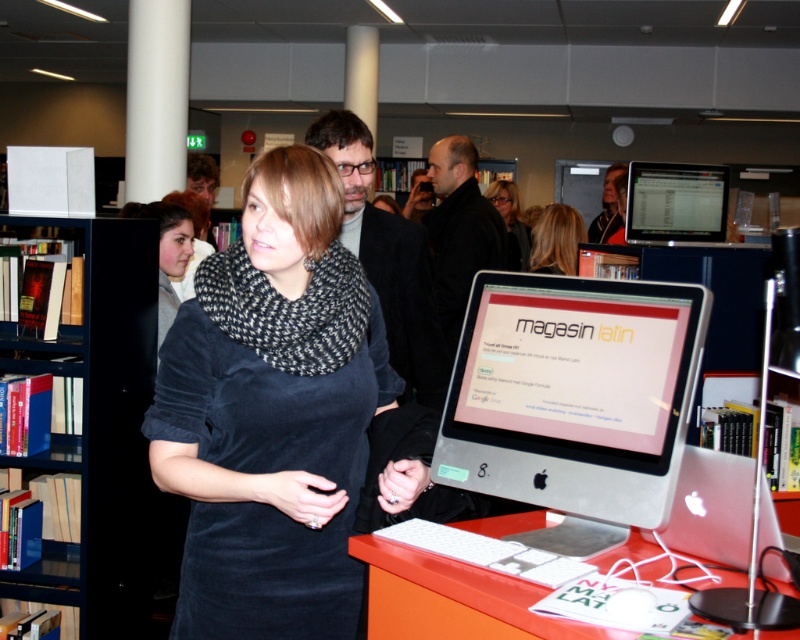
Question: Which point appears closest to the camera in this image?

Choices:
 (A) (484, 340)
 (B) (180, 208)
 (C) (210, 506)
 (D) (616, 216)

Answer: (C)

Question: Which is nearer to the silver metallic computer monitor at center?

Choices:
 (A) velvet dress at center
 (B) matte black jacket at center

Answer: (A)

Question: Does matte black jacket at center appear over gray knit scarf at center?

Choices:
 (A) no
 (B) yes

Answer: (A)

Question: Can you confirm if velvet dress at center is positioned above blonde hair at center?

Choices:
 (A) no
 (B) yes

Answer: (A)

Question: Which of these objects is positioned closest to the white smooth pillar at upper left?

Choices:
 (A) silver metallic computer monitor at center
 (B) velvet dress at center
 (C) gray knit scarf at center

Answer: (C)

Question: Is the position of matte black jacket at center less distant than that of blonde hair at center?

Choices:
 (A) yes
 (B) no

Answer: (A)